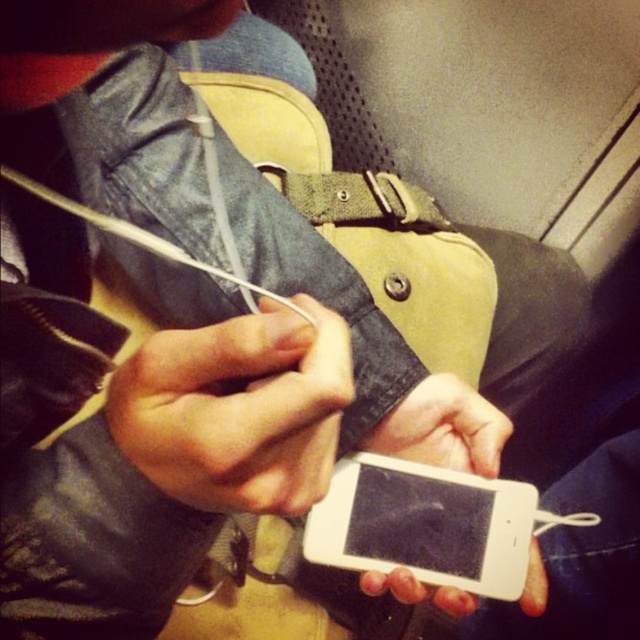
Question: Does matte black phone at center appear on the left side of white matte phone at center?

Choices:
 (A) no
 (B) yes

Answer: (B)

Question: Which point appears farthest from the camera in this image?

Choices:
 (A) pyautogui.click(x=218, y=492)
 (B) pyautogui.click(x=483, y=440)

Answer: (B)

Question: Which of the following is the closest to the observer?

Choices:
 (A) (161, 387)
 (B) (468, 422)

Answer: (A)

Question: From the image, what is the correct spatial relationship of matte black phone at center in relation to white matte phone at center?

Choices:
 (A) left
 (B) right

Answer: (A)

Question: Where is matte black phone at center located in relation to white matte phone at center in the image?

Choices:
 (A) above
 (B) below

Answer: (A)